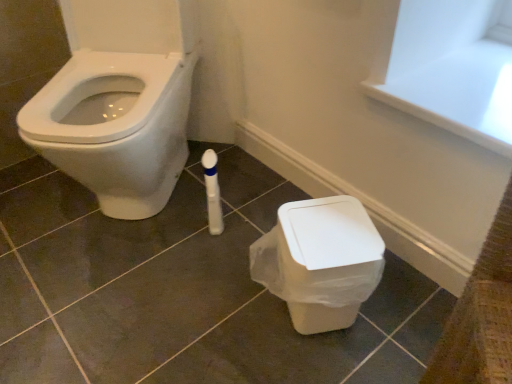
This screenshot has width=512, height=384. I want to click on free space in front of white plastic bin at lower right, so click(320, 365).